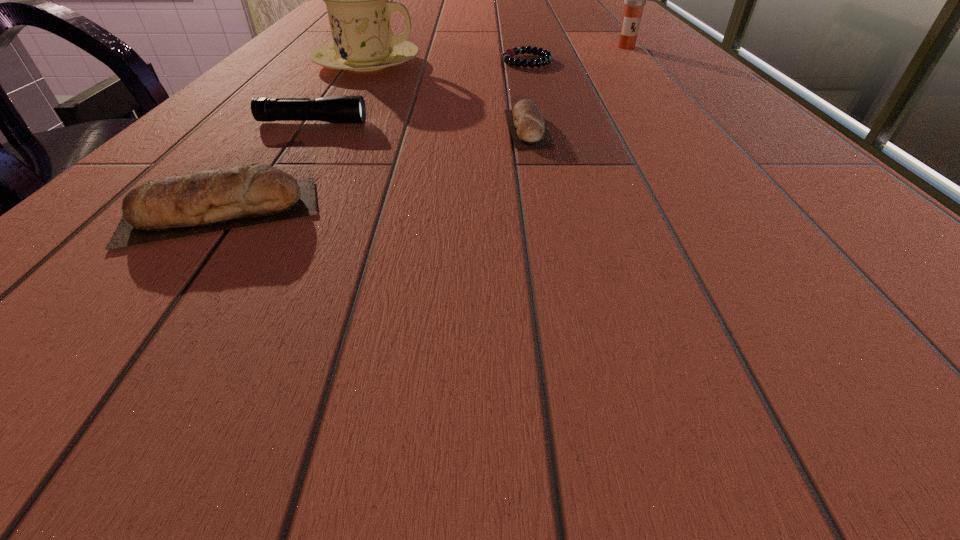
The height and width of the screenshot is (540, 960). What are the coordinates of `vacant space located 0.120m at the lens end of the flashlight` in the screenshot? It's located at (440, 123).

Locate an element on the screen. free space located on the handle side of the chinaware is located at coordinates (443, 63).

Where is `free space located on the label side of the medicine`? The image size is (960, 540). free space located on the label side of the medicine is located at coordinates (660, 86).

Locate an element on the screen. vacant space located 0.120m on the back of the bracelet is located at coordinates (521, 39).

The width and height of the screenshot is (960, 540). I want to click on object that is at the near edge, so click(207, 201).

Find the location of a particular element. The width and height of the screenshot is (960, 540). pita bread that is positioned at the left edge is located at coordinates (207, 201).

Find the location of a particular element. The image size is (960, 540). flashlight that is at the left edge is located at coordinates (347, 109).

Image resolution: width=960 pixels, height=540 pixels. I want to click on chinaware present at the left edge, so click(x=357, y=0).

The width and height of the screenshot is (960, 540). Identify the location of object at the right edge. (634, 0).

The image size is (960, 540). I want to click on object that is at the near left corner, so click(207, 201).